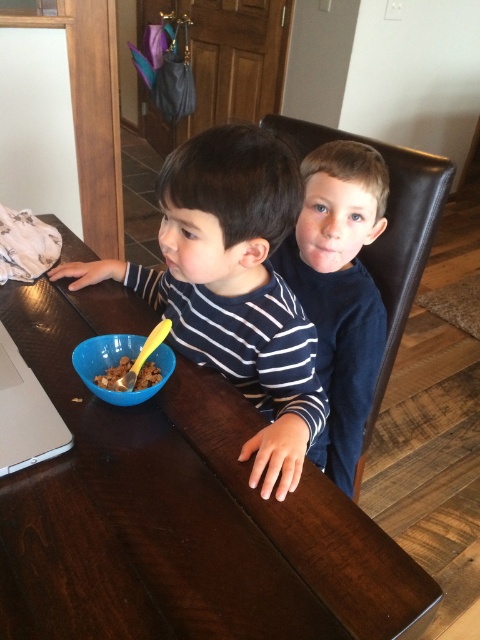
Consider the image. You are a parent trying to hand a spoon to your child who is sitting at the dark wooden dining table. The dark blue shirt at center is your child. The blue plastic bowl at center is in front of him. Where should you place the spoon so it is closest to the child?

The spoon should be placed near the blue plastic bowl at center since it is in front of the dark blue shirt at center, making it easily accessible to the child.

You are trying to locate the striped cotton shirt at center in a room with a silver metallic laptop at left. Based on their positions, which object is closer to the left side of the room?

The silver metallic laptop at left is closer to the left side of the room because the striped cotton shirt at center is to the right of it.